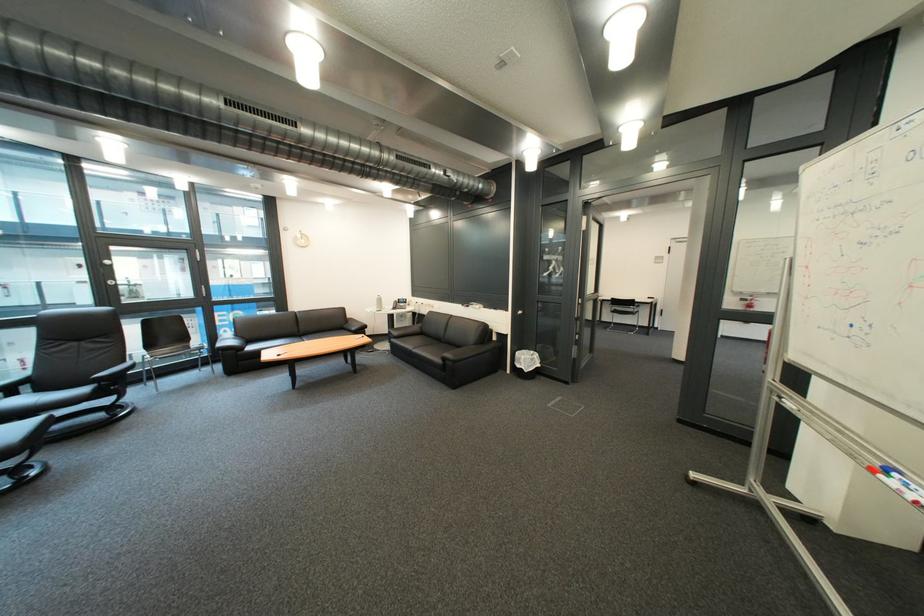
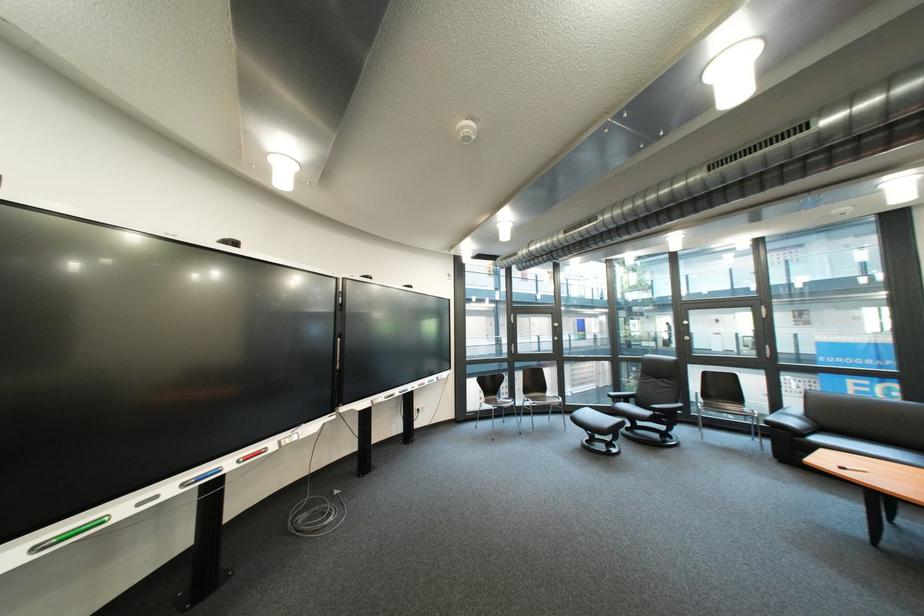
The point at (251, 338) is marked in the first image. Where is the corresponding point in the second image?

(822, 418)